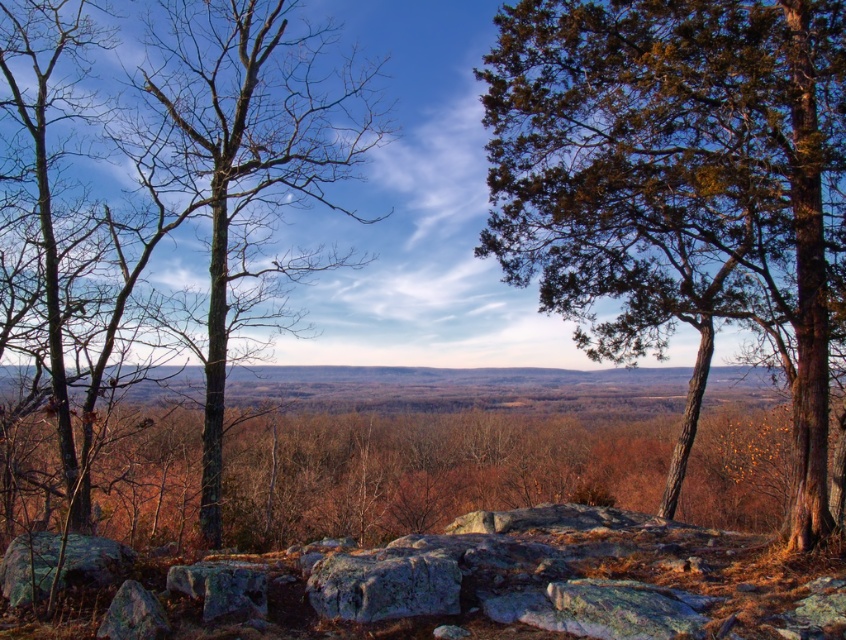
You are standing at the viewpoint overlooking the landscape and want to determine the relative positions of two points marked in the scene. Which point is closer to you, the observer, between the point at coordinates point (344, 168) and point (400, 589)?

The point at coordinates point (344, 168) is closer to you, the observer, as it is further to the viewer than point (400, 589).

You are a hiker trying to navigate through the rocky terrain. You see a green bark tree at left and a green mossy rock at lower left. Which one is taller?

The green bark tree at left is taller than the green mossy rock at lower left according to the description.

You are a hiker who wants to take a photo of the green bark tree at left and the gray rough boulder at center from a position where both are visible in the frame. Based on their heights, which object would appear larger in the photo?

The green bark tree at left is taller than the gray rough boulder at center, so it would appear larger in the photo.